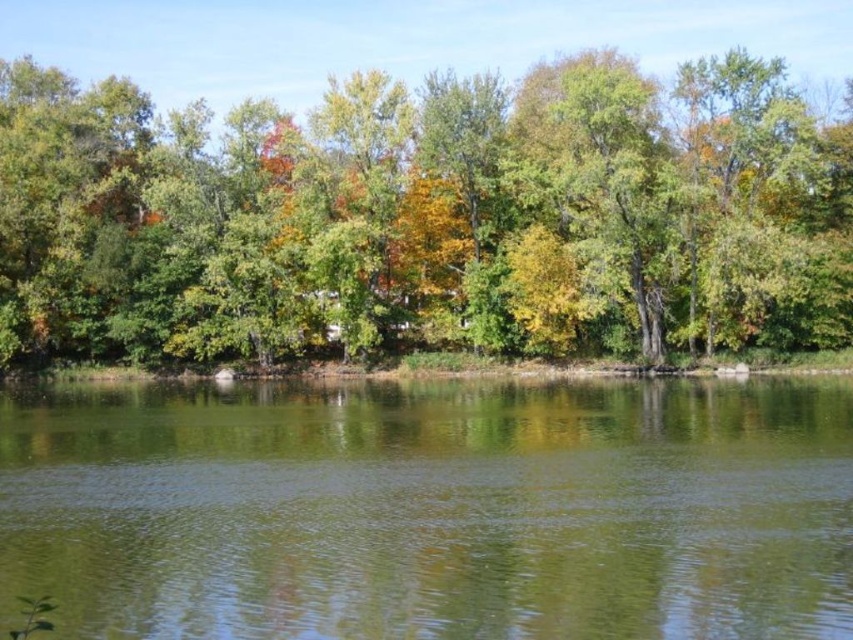
Question: Which of the following is the farthest from the observer?

Choices:
 (A) (416, 232)
 (B) (340, 492)

Answer: (A)

Question: Can you confirm if green matte tree at center is positioned to the left of green smooth water at center?

Choices:
 (A) no
 (B) yes

Answer: (A)

Question: Is green matte tree at center bigger than green smooth water at center?

Choices:
 (A) yes
 (B) no

Answer: (A)

Question: Does green matte tree at center come in front of green smooth water at center?

Choices:
 (A) no
 (B) yes

Answer: (A)